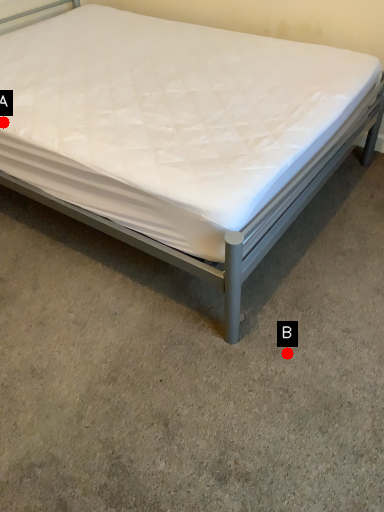
Question: Two points are circled on the image, labeled by A and B beside each circle. Which point appears closest to the camera in this image?

Choices:
 (A) A is closer
 (B) B is closer

Answer: (B)